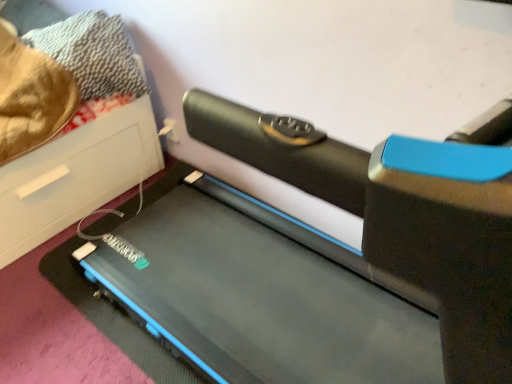
The image size is (512, 384). What are the coordinates of `black rubber treadmill at lower left` in the screenshot? It's located at (71, 177).

What is the approximate height of black rubber treadmill at lower left?

The height of black rubber treadmill at lower left is 28.61 inches.

Describe the element at coordinates (71, 177) in the screenshot. I see `black rubber treadmill at lower left` at that location.

The width and height of the screenshot is (512, 384). What do you see at coordinates (324, 259) in the screenshot?
I see `black rubber treadmill at center` at bounding box center [324, 259].

Measure the distance between black rubber treadmill at center and camera.

A distance of 1.10 meters exists between black rubber treadmill at center and camera.

Where is `black rubber treadmill at center`? The width and height of the screenshot is (512, 384). black rubber treadmill at center is located at coordinates (324, 259).

Where is `black rubber treadmill at lower left`? black rubber treadmill at lower left is located at coordinates (71, 177).

Looking at this image, which object is positioned more to the right, black rubber treadmill at lower left or black rubber treadmill at center?

black rubber treadmill at center.

Considering the positions of objects black rubber treadmill at lower left and black rubber treadmill at center in the image provided, who is behind, black rubber treadmill at lower left or black rubber treadmill at center?

black rubber treadmill at lower left.

Does point (0, 245) come closer to viewer compared to point (324, 165)?

No.

From the image's perspective, is black rubber treadmill at lower left above or below black rubber treadmill at center?

Clearly, from the image's perspective, black rubber treadmill at lower left is above black rubber treadmill at center.

From a real-world perspective, is black rubber treadmill at lower left positioned over black rubber treadmill at center based on gravity?

No, from a real-world perspective, black rubber treadmill at lower left is not on top of black rubber treadmill at center.

Looking at their sizes, would you say black rubber treadmill at lower left is wider or thinner than black rubber treadmill at center?

In the image, black rubber treadmill at lower left appears to be wider than black rubber treadmill at center.

In terms of height, does black rubber treadmill at lower left look taller or shorter compared to black rubber treadmill at center?

In the image, black rubber treadmill at lower left appears to be shorter than black rubber treadmill at center.

Which of these two, black rubber treadmill at lower left or black rubber treadmill at center, is smaller?

black rubber treadmill at lower left.

Is black rubber treadmill at lower left situated inside black rubber treadmill at center or outside?

black rubber treadmill at lower left is located beyond the bounds of black rubber treadmill at center.

Are black rubber treadmill at lower left and black rubber treadmill at center beside each other?

black rubber treadmill at lower left is not next to black rubber treadmill at center, and they're not touching.

Based on the photo, is black rubber treadmill at lower left oriented away from black rubber treadmill at center?

black rubber treadmill at lower left is not turned away from black rubber treadmill at center.

Measure the distance between black rubber treadmill at lower left and black rubber treadmill at center.

black rubber treadmill at lower left is 18.63 inches away from black rubber treadmill at center.

Where is `furniture that appears behind the black rubber treadmill at center`? The height and width of the screenshot is (384, 512). furniture that appears behind the black rubber treadmill at center is located at coordinates (71, 177).

Can you confirm if black rubber treadmill at center is positioned to the left of black rubber treadmill at lower left?

In fact, black rubber treadmill at center is to the right of black rubber treadmill at lower left.

Is black rubber treadmill at center closer to camera compared to black rubber treadmill at lower left?

Yes, black rubber treadmill at center is closer to the viewer.

Which is closer, (329, 245) or (84, 167)?

The point (329, 245) is in front.

From the image's perspective, which is above, black rubber treadmill at center or black rubber treadmill at lower left?

From the image's view, black rubber treadmill at lower left is above.

From a real-world perspective, between black rubber treadmill at center and black rubber treadmill at lower left, who is vertically higher?

In real-world perspective, black rubber treadmill at center is above.

Can you confirm if black rubber treadmill at center is thinner than black rubber treadmill at lower left?

Correct, the width of black rubber treadmill at center is less than that of black rubber treadmill at lower left.

Is black rubber treadmill at center shorter than black rubber treadmill at lower left?

Incorrect, the height of black rubber treadmill at center does not fall short of that of black rubber treadmill at lower left.

Is black rubber treadmill at center smaller than black rubber treadmill at lower left?

Incorrect, black rubber treadmill at center is not smaller in size than black rubber treadmill at lower left.

Is black rubber treadmill at lower left located within black rubber treadmill at center?

Answer: No, black rubber treadmill at lower left is located outside of black rubber treadmill at center.

Does black rubber treadmill at center touch black rubber treadmill at lower left?

black rubber treadmill at center and black rubber treadmill at lower left are not in contact.

Is black rubber treadmill at center facing towards black rubber treadmill at lower left?

No, black rubber treadmill at center is not aimed at black rubber treadmill at lower left.

What's the angular difference between black rubber treadmill at center and black rubber treadmill at lower left's facing directions?

88.6 degrees.

Measure the distance from black rubber treadmill at center to black rubber treadmill at lower left.

47.33 centimeters.

Locate an element on the screen. The width and height of the screenshot is (512, 384). furniture above the black rubber treadmill at center (from the image's perspective) is located at coordinates click(x=71, y=177).

At what (x,y) coordinates should I click in order to perform the action: click on furniture beneath the black rubber treadmill at center (from a real-world perspective). Please return your answer as a coordinate pair (x, y). This screenshot has height=384, width=512. Looking at the image, I should click on click(x=71, y=177).

At what (x,y) coordinates should I click in order to perform the action: click on treadmill below the black rubber treadmill at lower left (from the image's perspective). Please return your answer as a coordinate pair (x, y). The image size is (512, 384). Looking at the image, I should click on (324, 259).